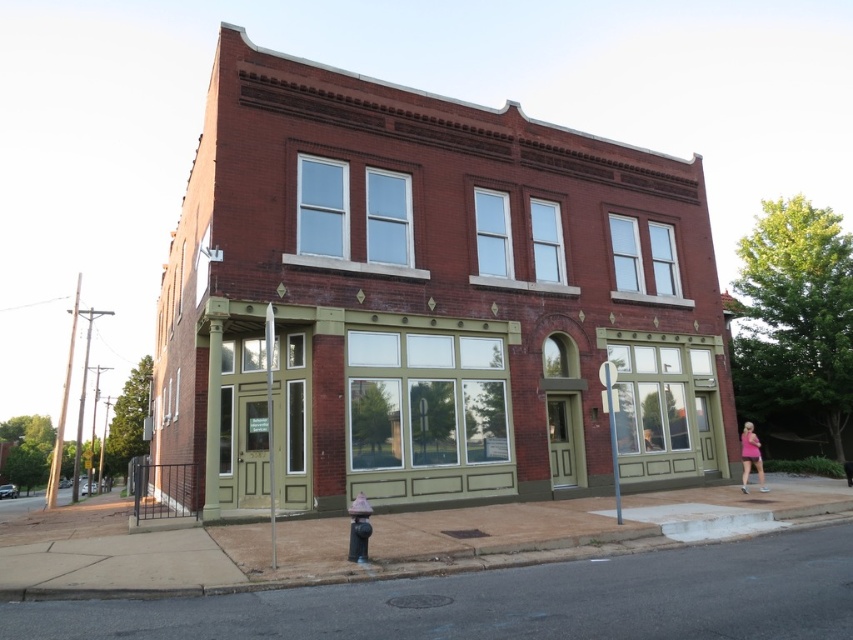
You are standing in front of the brick building at center and want to hang a pink fabric dress at lower right near the entrance. Considering the spatial relationship between the two, where should you place the dress relative to the building?

The brick building at center is closer to the viewer than the pink fabric dress at lower right, so you should place the pink fabric dress at lower right behind the brick building at center to maintain their spatial relationship.

You are a photographer standing in front of the brick building at center and the pink fabric dress at lower right. You want to take a photo that captures both objects in the frame. Which object should you focus on to ensure both are in the frame without moving your position?

You should focus on the brick building at center because it is larger than the pink fabric dress at lower right, so keeping it centered will allow the smaller dress to fit within the frame as well.